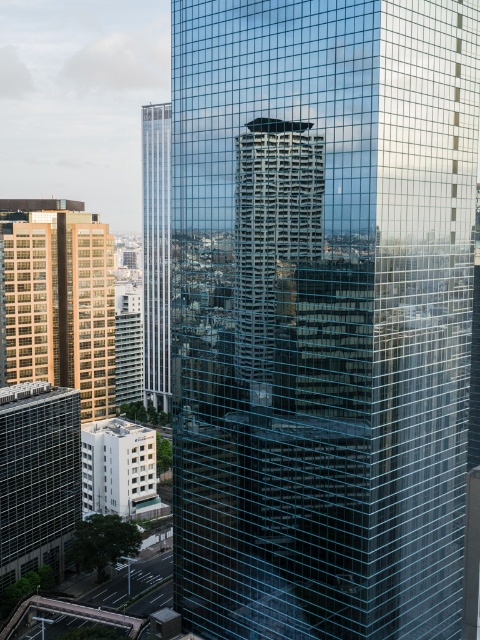
Is reflective glass tower at center to the right of golden glass building at left from the viewer's perspective?

Yes, reflective glass tower at center is to the right of golden glass building at left.

Describe the element at coordinates (274, 250) in the screenshot. The image size is (480, 640). I see `reflective glass tower at center` at that location.

The width and height of the screenshot is (480, 640). What do you see at coordinates (274, 250) in the screenshot? I see `reflective glass tower at center` at bounding box center [274, 250].

The image size is (480, 640). In order to click on reflective glass tower at center in this screenshot , I will do `click(274, 250)`.

Is reflective glass tower at center to the left of clear glass skyscraper at center from the viewer's perspective?

In fact, reflective glass tower at center is to the right of clear glass skyscraper at center.

Is point (295, 344) less distant than point (148, 403)?

Yes, it is in front of point (148, 403).

Who is more forward, [311,211] or [168,122]?

Point [311,211] is more forward.

The height and width of the screenshot is (640, 480). In order to click on reflective glass tower at center in this screenshot , I will do `click(274, 250)`.

Is reflective glass tower at center below matte glass building at lower left?

No.

Which of these two, reflective glass tower at center or matte glass building at lower left, stands shorter?

Standing shorter between the two is reflective glass tower at center.

Consider the image. Who is more distant from viewer, (289,356) or (72,483)?

Point (72,483)

Identify the location of reflective glass tower at center. This screenshot has width=480, height=640. (x=274, y=250).